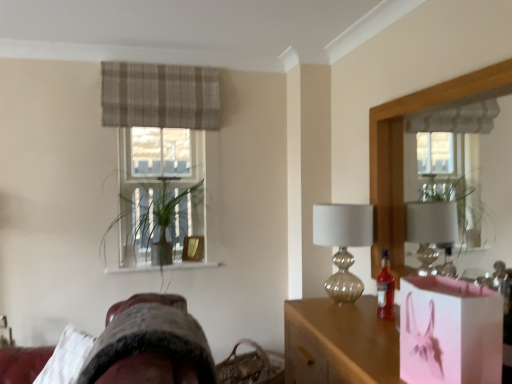
In order to click on vacant space situated above plaid fabric curtain at upper center (from a real-world perspective) in this screenshot , I will do `click(163, 65)`.